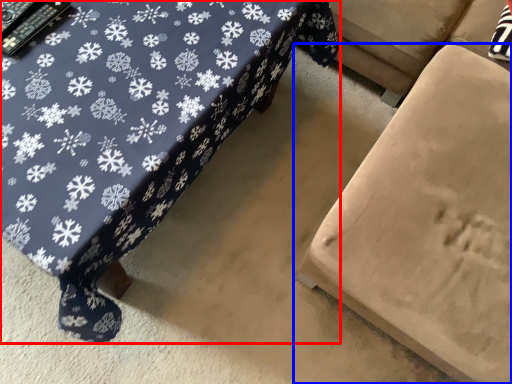
Question: Which point is further to the camera, table (highlighted by a red box) or furniture (highlighted by a blue box)?

Choices:
 (A) table
 (B) furniture

Answer: (A)